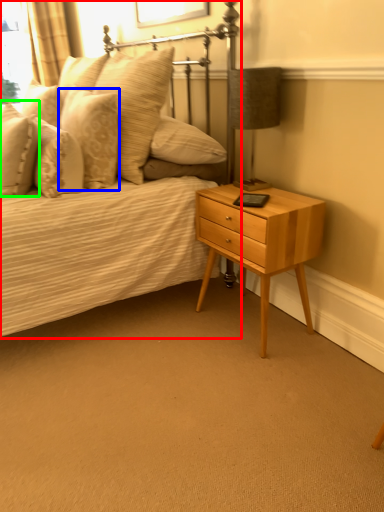
Question: Which is nearer to the bed (highlighted by a red box)? pillow (highlighted by a blue box) or pillow (highlighted by a green box).

Choices:
 (A) pillow
 (B) pillow

Answer: (A)